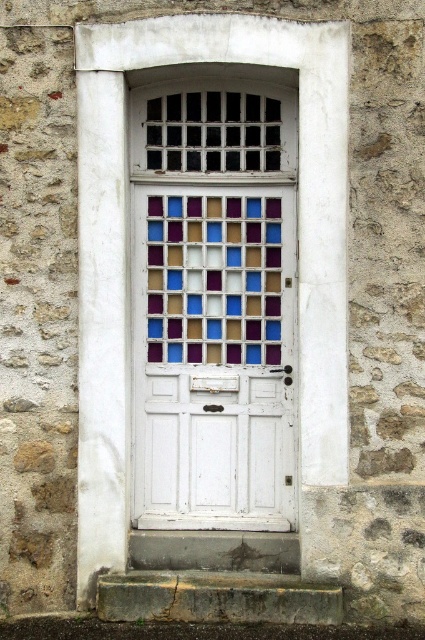
You are standing in front of the white painted wooden door with stained glass panels. There is a point at coordinates [127,250] on the door. What material is at that point?

The point at [127,250] on the door is white painted wood, as indicated by the Objects Description.